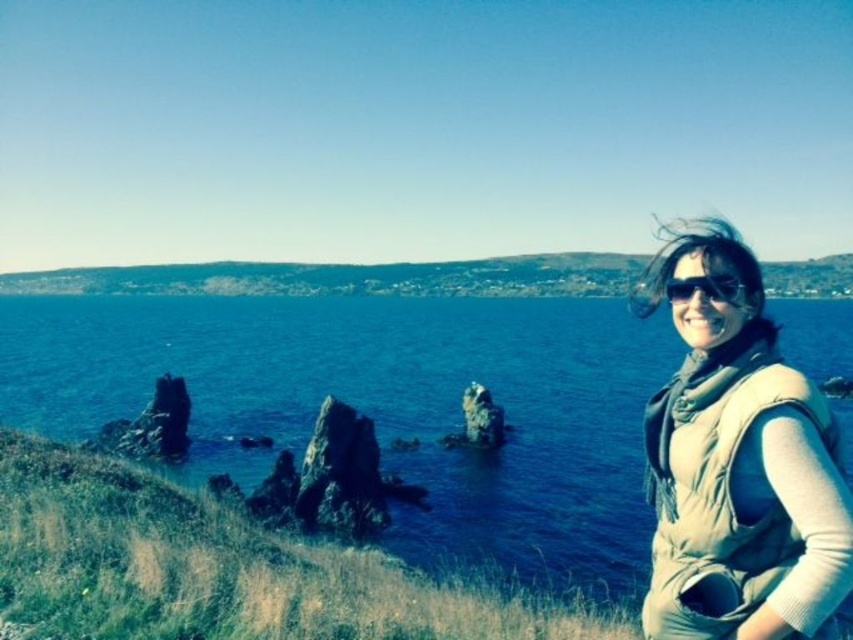
From the picture: You are standing on the cliffside and want to place both the beige fabric scarf at right and the matte black goggles at right into a rectangular box. The box has a height limit of 20 cm. If the goggles are 10 cm tall, will both items fit vertically in the box?

The beige fabric scarf at right is much taller than the matte black goggles at right. Since the goggles are 10 cm tall, the scarf must be taller than 10 cm. The box has a 20 cm height limit. If the scarf is taller than 10 cm but less than or equal to 20 cm, both items could potentially fit. However, if the scarf exceeds 20 cm, it won